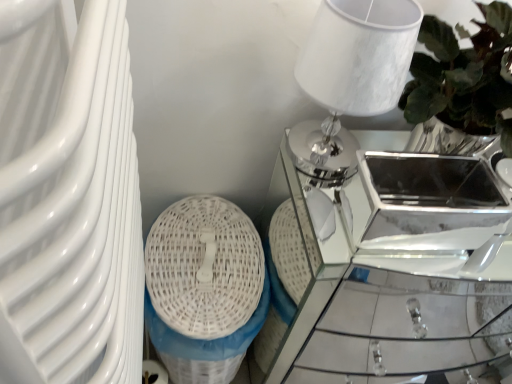
Question: Considering the relative sizes of white wicker basket at lower left and white marble table lamp at upper right in the image provided, is white wicker basket at lower left bigger than white marble table lamp at upper right?

Choices:
 (A) yes
 (B) no

Answer: (A)

Question: Does white wicker basket at lower left contain white marble table lamp at upper right?

Choices:
 (A) no
 (B) yes

Answer: (A)

Question: From a real-world perspective, is white wicker basket at lower left under white marble table lamp at upper right?

Choices:
 (A) yes
 (B) no

Answer: (A)

Question: Is white wicker basket at lower left closer to camera compared to white marble table lamp at upper right?

Choices:
 (A) yes
 (B) no

Answer: (B)

Question: Could you tell me if white wicker basket at lower left is facing white marble table lamp at upper right?

Choices:
 (A) yes
 (B) no

Answer: (B)

Question: Is mirror glass table at center taller or shorter than white marble table lamp at upper right?

Choices:
 (A) short
 (B) tall

Answer: (B)

Question: Considering the positions of mirror glass table at center and white marble table lamp at upper right in the image, is mirror glass table at center bigger or smaller than white marble table lamp at upper right?

Choices:
 (A) small
 (B) big

Answer: (B)

Question: Considering their positions, is mirror glass table at center located in front of or behind white marble table lamp at upper right?

Choices:
 (A) front
 (B) behind

Answer: (B)

Question: Choose the correct answer: Is mirror glass table at center inside white marble table lamp at upper right or outside it?

Choices:
 (A) outside
 (B) inside

Answer: (A)

Question: Relative to white wicker basket at lower left, is mirror glass table at center in front or behind?

Choices:
 (A) front
 (B) behind

Answer: (A)

Question: Is mirror glass table at center wider or thinner than white wicker basket at lower left?

Choices:
 (A) thin
 (B) wide

Answer: (B)

Question: Considering the positions of mirror glass table at center and white wicker basket at lower left in the image, is mirror glass table at center taller or shorter than white wicker basket at lower left?

Choices:
 (A) short
 (B) tall

Answer: (B)

Question: In terms of size, does mirror glass table at center appear bigger or smaller than white wicker basket at lower left?

Choices:
 (A) big
 (B) small

Answer: (A)

Question: In the image, is white wicker basket at lower left positioned in front of or behind mirror glass table at center?

Choices:
 (A) behind
 (B) front

Answer: (A)

Question: From the image's perspective, is white wicker basket at lower left located above or below mirror glass table at center?

Choices:
 (A) above
 (B) below

Answer: (B)